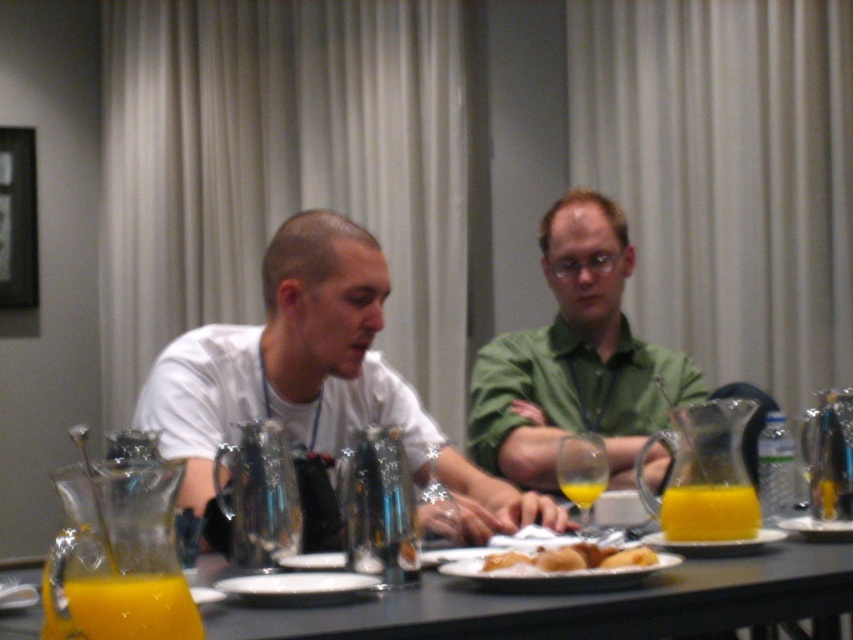
What do you see at coordinates (709, 513) in the screenshot?
I see `yellow translucent pitcher at center` at bounding box center [709, 513].

Between yellow translucent pitcher at center and yellow translucent glass at center, which one appears on the left side from the viewer's perspective?

yellow translucent glass at center is more to the left.

This screenshot has height=640, width=853. Identify the location of yellow translucent pitcher at center. (709, 513).

Locate an element on the screen. translucent glass pitcher of orange juice at table center is located at coordinates (132, 608).

Looking at this image, does translucent glass pitcher of orange juice at table center appear on the right side of yellow translucent pitcher at center?

In fact, translucent glass pitcher of orange juice at table center is to the left of yellow translucent pitcher at center.

Identify the location of translucent glass pitcher of orange juice at table center. (132, 608).

Image resolution: width=853 pixels, height=640 pixels. In order to click on translucent glass pitcher of orange juice at table center in this screenshot , I will do click(132, 608).

Image resolution: width=853 pixels, height=640 pixels. What do you see at coordinates (572, 557) in the screenshot? I see `golden brown bread at center` at bounding box center [572, 557].

Does golden brown bread at center have a larger size compared to yellow translucent glass at center?

Yes.

Which is in front, point (521, 557) or point (601, 486)?

Point (521, 557) is more forward.

The width and height of the screenshot is (853, 640). Identify the location of golden brown bread at center. (572, 557).